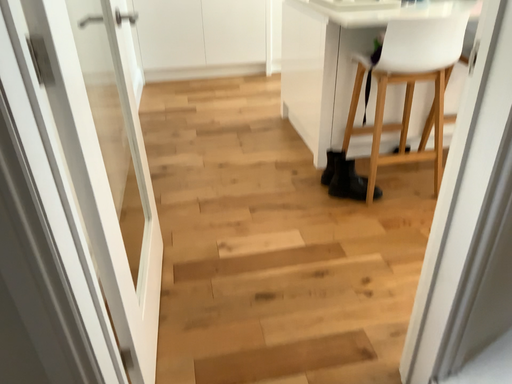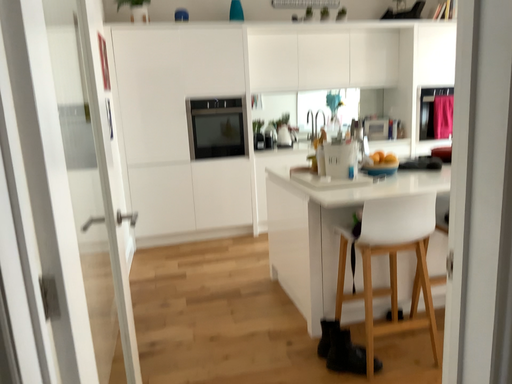
Question: How did the camera likely rotate when shooting the video?

Choices:
 (A) rotated upward
 (B) rotated downward

Answer: (A)